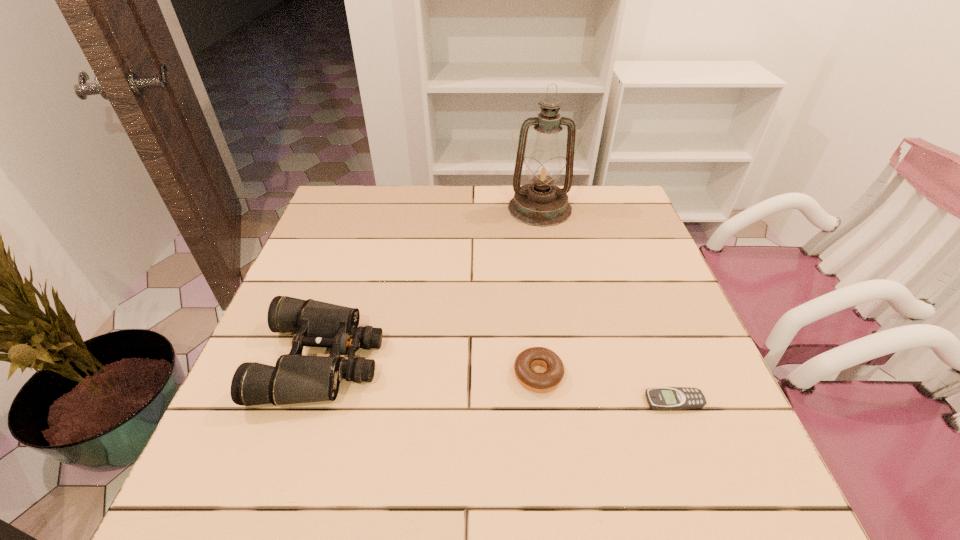
Image resolution: width=960 pixels, height=540 pixels. In order to click on object that stands as the closest to the doughnut in this screenshot , I will do `click(663, 398)`.

The image size is (960, 540). In order to click on the third closest object relative to the third shortest object in this screenshot , I will do `click(663, 398)`.

Identify the location of vacant space that satisfies the following two spatial constraints: 1. on the front side of the shortest object; 2. on the left side of the second shortest object. (541, 401).

You are a GUI agent. You are given a task and a screenshot of the screen. Output one action in this format:
    pyautogui.click(x=<x>, y=<y>)
    Task: Click on the free spot that satisfies the following two spatial constraints: 1. on the back side of the second shortest object; 2. on the left side of the tallest object
    The image size is (960, 540).
    Given the screenshot: What is the action you would take?
    pyautogui.click(x=518, y=208)

Identify the location of free space that satisfies the following two spatial constraints: 1. through the eyepieces of the leftmost object; 2. on the back side of the rightmost object. (308, 401).

This screenshot has height=540, width=960. In order to click on free space that satisfies the following two spatial constraints: 1. on the back side of the third tallest object; 2. through the eyepieces of the second tallest object in this screenshot , I will do `click(537, 360)`.

Locate an element on the screen. The image size is (960, 540). vacant region that satisfies the following two spatial constraints: 1. through the eyepieces of the doughnut; 2. on the left side of the binoculars is located at coordinates (318, 374).

Identify the location of free location that satisfies the following two spatial constraints: 1. through the eyepieces of the binoculars; 2. on the right side of the doughnut. The height and width of the screenshot is (540, 960). (318, 374).

Identify the location of vacant space that satisfies the following two spatial constraints: 1. through the eyepieces of the rightmost object; 2. on the right side of the binoculars. The width and height of the screenshot is (960, 540). (308, 401).

Identify the location of vacant space that satisfies the following two spatial constraints: 1. on the front side of the doughnut; 2. on the right side of the rightmost object. The image size is (960, 540). (541, 401).